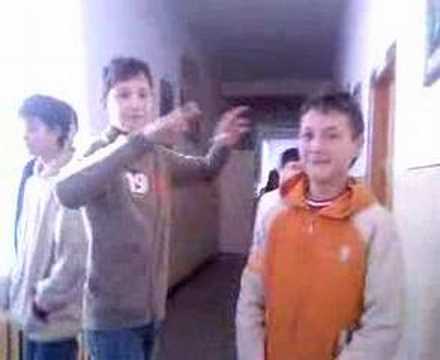
I want to click on floor, so click(x=213, y=316).